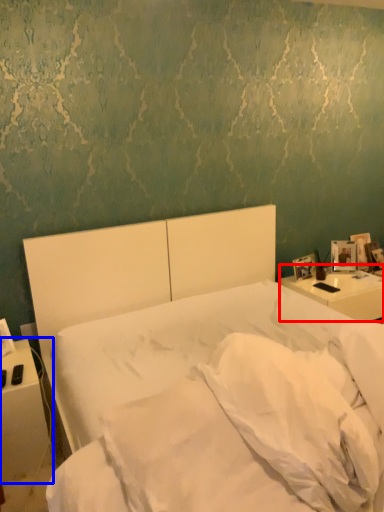
Question: Which object is further to the camera taking this photo, nightstand (highlighted by a red box) or nightstand (highlighted by a blue box)?

Choices:
 (A) nightstand
 (B) nightstand

Answer: (A)